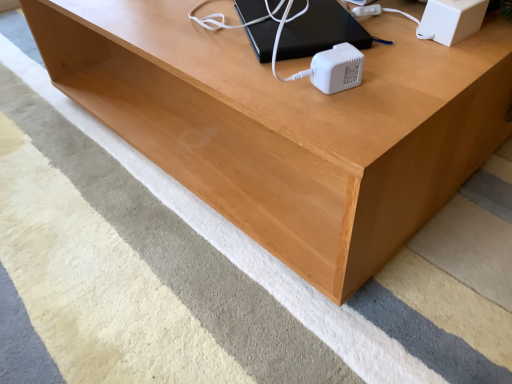
Question: Is white plastic speaker at upper right closer to camera compared to black plastic computer at upper center?

Choices:
 (A) yes
 (B) no

Answer: (A)

Question: From the image's perspective, does white plastic speaker at upper right appear lower than black plastic computer at upper center?

Choices:
 (A) no
 (B) yes

Answer: (B)

Question: Is white plastic speaker at upper right next to black plastic computer at upper center and touching it?

Choices:
 (A) yes
 (B) no

Answer: (B)

Question: Is white plastic speaker at upper right located outside black plastic computer at upper center?

Choices:
 (A) no
 (B) yes

Answer: (B)

Question: Is white plastic speaker at upper right bigger than black plastic computer at upper center?

Choices:
 (A) no
 (B) yes

Answer: (A)

Question: Does white plastic speaker at upper right have a greater width compared to black plastic computer at upper center?

Choices:
 (A) yes
 (B) no

Answer: (B)

Question: Is black plastic computer at upper center wider than white plastic speaker at upper right?

Choices:
 (A) yes
 (B) no

Answer: (A)

Question: Is black plastic computer at upper center in front of white plastic speaker at upper right?

Choices:
 (A) no
 (B) yes

Answer: (A)

Question: Could you tell me if black plastic computer at upper center is facing white plastic speaker at upper right?

Choices:
 (A) no
 (B) yes

Answer: (B)

Question: Does black plastic computer at upper center have a lesser height compared to white plastic speaker at upper right?

Choices:
 (A) yes
 (B) no

Answer: (A)

Question: Can you confirm if black plastic computer at upper center is smaller than white plastic speaker at upper right?

Choices:
 (A) no
 (B) yes

Answer: (A)

Question: Is black plastic computer at upper center not near white plastic speaker at upper right?

Choices:
 (A) no
 (B) yes

Answer: (A)

Question: From a real-world perspective, relative to white plastic speaker at upper right, is black plastic computer at upper center vertically above or below?

Choices:
 (A) above
 (B) below

Answer: (B)